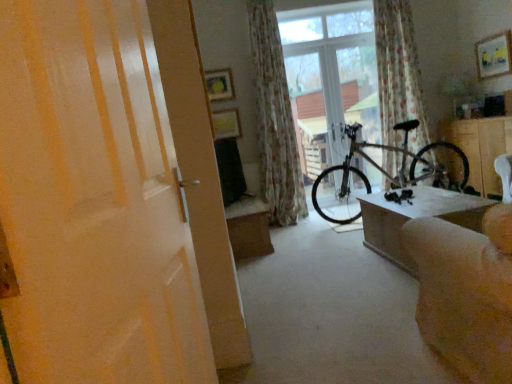
Question: Looking at their shapes, would you say wooden table at center, marked as the first table in a back-to-front arrangement, is wider or thinner than wooden cabinet at right?

Choices:
 (A) thin
 (B) wide

Answer: (A)

Question: From the image's perspective, is wooden table at center, placed as the second table when sorted from front to back, located above or below wooden cabinet at right?

Choices:
 (A) below
 (B) above

Answer: (A)

Question: Based on their relative distances, which object is nearer to the beige fabric couch at lower right?

Choices:
 (A) floral fabric curtain at center, acting as the second curtain starting from the left
 (B) matte wooden picture frame at upper center, the first picture frame from the left
 (C) matte white door at center
 (D) transparent glass window at center
 (E) matte yellow picture frame at upper center, which appears as the second picture frame when viewed from the right

Answer: (C)

Question: Estimate the real-world distances between objects in this image. Which object is closer to the matte white door at center?

Choices:
 (A) floral fabric curtain at center, acting as the second curtain starting from the left
 (B) wooden cabinet at right
 (C) wooden coffee table at lower right, which ranks as the 2th table in left-to-right order
 (D) matte yellow picture frame at upper center, which ranks as the first picture frame in bottom-to-top order
 (E) wooden table at center, the first table from the left

Answer: (C)